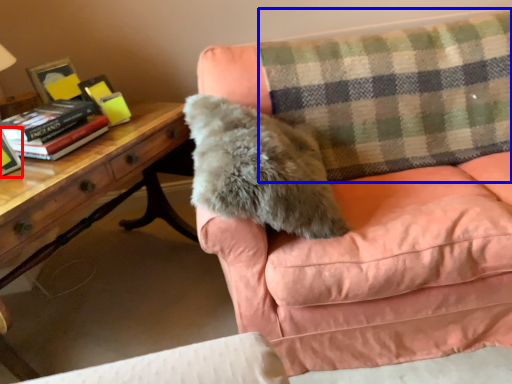
Question: Which point is closer to the camera, paperback book (highlighted by a red box) or plaid (highlighted by a blue box)?

Choices:
 (A) paperback book
 (B) plaid

Answer: (A)